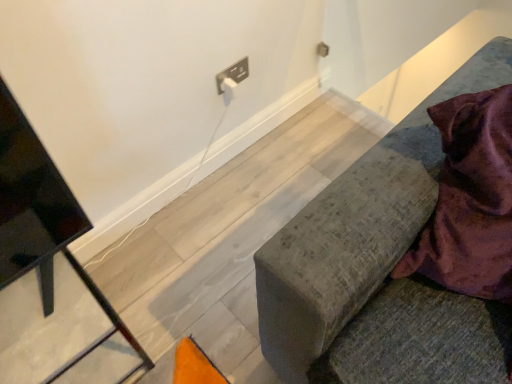
Question: Is velvet grey cushion at right, marked as the first furniture in a right-to-left arrangement, looking in the opposite direction of black metal tv stand at left, which is counted as the 2th furniture, starting from the right?

Choices:
 (A) no
 (B) yes

Answer: (A)

Question: Does velvet grey cushion at right, marked as the first furniture in a right-to-left arrangement, appear on the right side of black metal tv stand at left, which is counted as the 2th furniture, starting from the right?

Choices:
 (A) no
 (B) yes

Answer: (B)

Question: From the image's perspective, would you say velvet grey cushion at right, which is the 2th furniture from left to right, is positioned over black metal tv stand at left, which is counted as the 2th furniture, starting from the right?

Choices:
 (A) no
 (B) yes

Answer: (B)

Question: Is velvet grey cushion at right, marked as the first furniture in a right-to-left arrangement, completely or partially outside of black metal tv stand at left, acting as the 1th furniture starting from the left?

Choices:
 (A) no
 (B) yes

Answer: (B)

Question: Can you confirm if velvet grey cushion at right, which is the 2th furniture from left to right, is thinner than black metal tv stand at left, acting as the 1th furniture starting from the left?

Choices:
 (A) yes
 (B) no

Answer: (B)

Question: Is velvet purple blanket at right inside or outside of black metal tv stand at left, which is counted as the 2th furniture, starting from the right?

Choices:
 (A) inside
 (B) outside

Answer: (B)

Question: Is velvet purple blanket at right in front of or behind black metal tv stand at left, which is counted as the 2th furniture, starting from the right, in the image?

Choices:
 (A) front
 (B) behind

Answer: (A)

Question: Is point (493, 292) closer or farther from the camera than point (89, 355)?

Choices:
 (A) closer
 (B) farther

Answer: (A)

Question: Is velvet purple blanket at right taller or shorter than black metal tv stand at left, acting as the 1th furniture starting from the left?

Choices:
 (A) short
 (B) tall

Answer: (B)

Question: Is black metal tv stand at left, acting as the 1th furniture starting from the left, situated inside velvet purple blanket at right or outside?

Choices:
 (A) outside
 (B) inside

Answer: (A)

Question: Considering the relative positions of black metal tv stand at left, acting as the 1th furniture starting from the left, and velvet purple blanket at right in the image provided, is black metal tv stand at left, acting as the 1th furniture starting from the left, to the left or to the right of velvet purple blanket at right?

Choices:
 (A) left
 (B) right

Answer: (A)

Question: From the image's perspective, relative to velvet purple blanket at right, is black metal tv stand at left, acting as the 1th furniture starting from the left, above or below?

Choices:
 (A) below
 (B) above

Answer: (A)

Question: Looking at the image, does black metal tv stand at left, acting as the 1th furniture starting from the left, seem bigger or smaller compared to velvet purple blanket at right?

Choices:
 (A) big
 (B) small

Answer: (A)

Question: Considering the positions of velvet grey cushion at right, marked as the first furniture in a right-to-left arrangement, and velvet purple blanket at right in the image, is velvet grey cushion at right, marked as the first furniture in a right-to-left arrangement, wider or thinner than velvet purple blanket at right?

Choices:
 (A) thin
 (B) wide

Answer: (B)

Question: From a real-world perspective, is velvet grey cushion at right, marked as the first furniture in a right-to-left arrangement, above or below velvet purple blanket at right?

Choices:
 (A) above
 (B) below

Answer: (B)